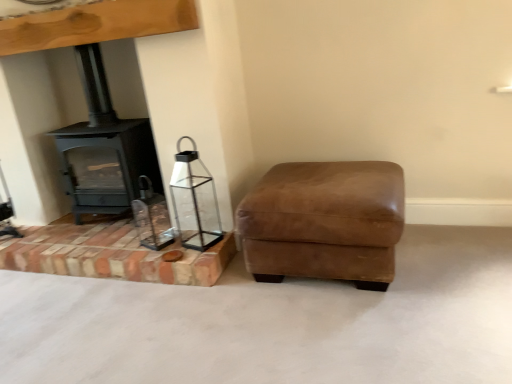
I want to click on free spot in front of clear glass lantern at lower left, so click(193, 254).